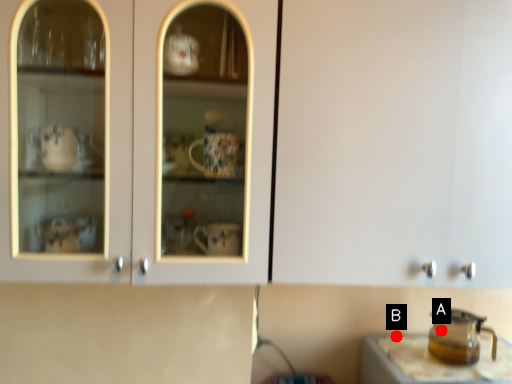
Question: Two points are circled on the image, labeled by A and B beside each circle. Among these points, which one is nearest to the camera?

Choices:
 (A) A is closer
 (B) B is closer

Answer: (A)